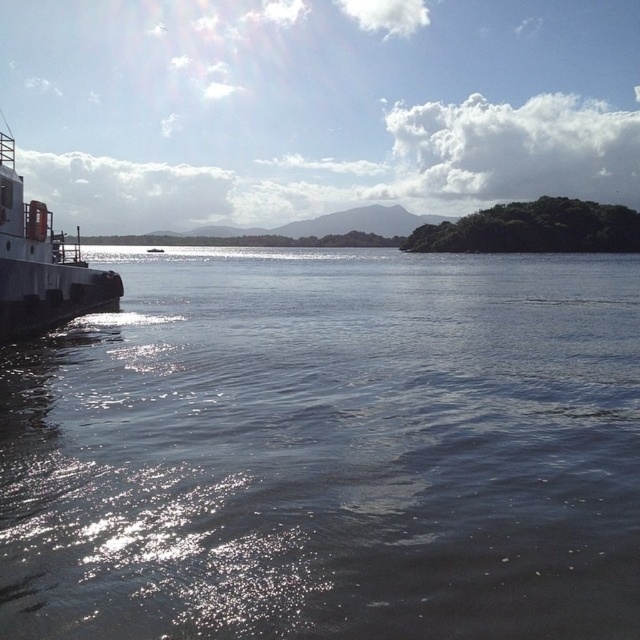
You are a photographer planning to capture the dark blue water at lower left and the metallic gray boat at left in a single shot. Based on their sizes in the image, which object would appear more prominent in the photo?

The dark blue water at lower left would appear more prominent in the photo since it is larger in size than the metallic gray boat at left.

You are standing on the riverside path and see the dark blue water at lower left and the metallic gray boat at left. Which one is closer to you?

The dark blue water at lower left is closer to you because it is in front of the metallic gray boat at left.

Consider the image. You are standing at the center of the image and want to locate the dark blue water at lower left. Based on the coordinates provided, in which direction should you move to face it?

The dark blue water at lower left is located at coordinates point (328, 451). Since you are at the center, you need to move towards the lower left direction to face it.